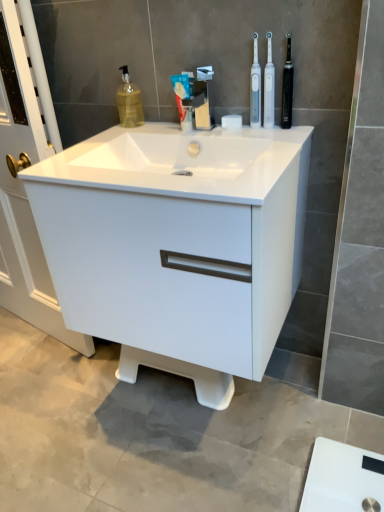
Find the location of a particular element. This screenshot has height=512, width=384. free spot to the left of black rubber toothbrush at upper right is located at coordinates (231, 129).